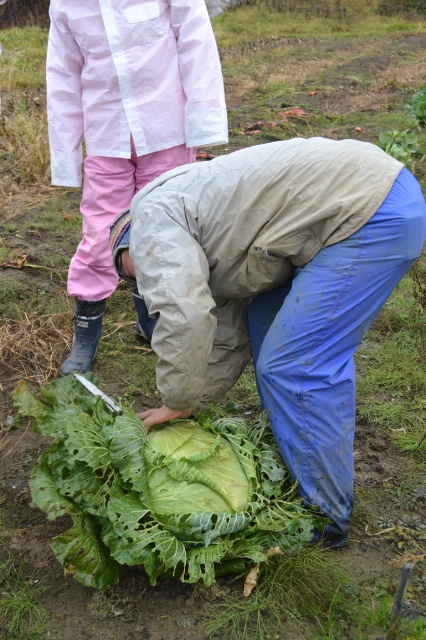
Question: Does green leafy cabbage at center appear on the right side of pink fabric pants at lower left?

Choices:
 (A) no
 (B) yes

Answer: (B)

Question: Which point is closer to the camera?

Choices:
 (A) green leafy vegetable at center
 (B) pink fabric pants at lower left

Answer: (A)

Question: In this image, where is green leafy cabbage at center located relative to pink fabric pants at lower left?

Choices:
 (A) right
 (B) left

Answer: (A)

Question: Can you confirm if green leafy vegetable at center is thinner than green leafy cabbage at center?

Choices:
 (A) yes
 (B) no

Answer: (B)

Question: Which object appears farthest from the camera in this image?

Choices:
 (A) green leafy vegetable at center
 (B) pink fabric pants at lower left
 (C) green leafy cabbage at center

Answer: (B)

Question: Among these points, which one is nearest to the camera?

Choices:
 (A) (86, 477)
 (B) (120, 10)

Answer: (A)